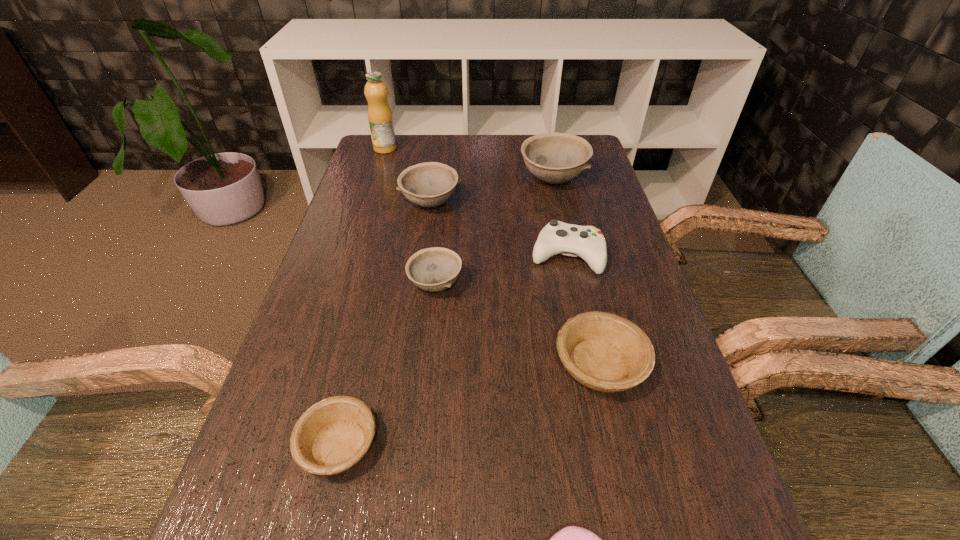
Identify the location of free space that is in between the smallest gray bowl and the rightmost gray bowl. (494, 232).

You are a GUI agent. You are given a task and a screenshot of the screen. Output one action in this format:
    pyautogui.click(x=<x>, y=<y>)
    Task: Click on the blank region between the tallest object and the right beige bowl
    This screenshot has height=540, width=960.
    Given the screenshot: What is the action you would take?
    pyautogui.click(x=492, y=256)

At what (x,y) coordinates should I click in order to perform the action: click on unoccupied area between the second tallest object and the bigger beige bowl. Please return your answer as a coordinate pair (x, y). The width and height of the screenshot is (960, 540). Looking at the image, I should click on (576, 272).

Locate an element on the screen. free space between the right beige bowl and the third farthest bowl is located at coordinates (517, 325).

You are a GUI agent. You are given a task and a screenshot of the screen. Output one action in this format:
    pyautogui.click(x=<x>, y=<y>)
    Task: Click on the free space between the white control and the second shortest object
    This screenshot has height=540, width=960.
    Given the screenshot: What is the action you would take?
    pyautogui.click(x=453, y=350)

This screenshot has height=540, width=960. Find the location of `vacant area that lies between the smaller beige bowl and the rightmost gray bowl`. vacant area that lies between the smaller beige bowl and the rightmost gray bowl is located at coordinates (446, 312).

At what (x,y) coordinates should I click in order to perform the action: click on vacant area that lies between the control and the bigger beige bowl. Please return your answer as a coordinate pair (x, y). The height and width of the screenshot is (540, 960). Looking at the image, I should click on (583, 310).

The width and height of the screenshot is (960, 540). In order to click on free space between the farther beige bowl and the white control in this screenshot , I will do `click(583, 310)`.

Select which object is the seventh closest to the nearest gray bowl. Please provide its 2D coordinates. Your answer should be formatted as a tuple, i.e. [(x, y)], where the tuple contains the x and y coordinates of a point satisfying the conditions above.

[(380, 118)]

Identify which object is the seventh nearest to the second tallest bowl. Please provide its 2D coordinates. Your answer should be formatted as a tuple, i.e. [(x, y)], where the tuple contains the x and y coordinates of a point satisfying the conditions above.

[(572, 539)]